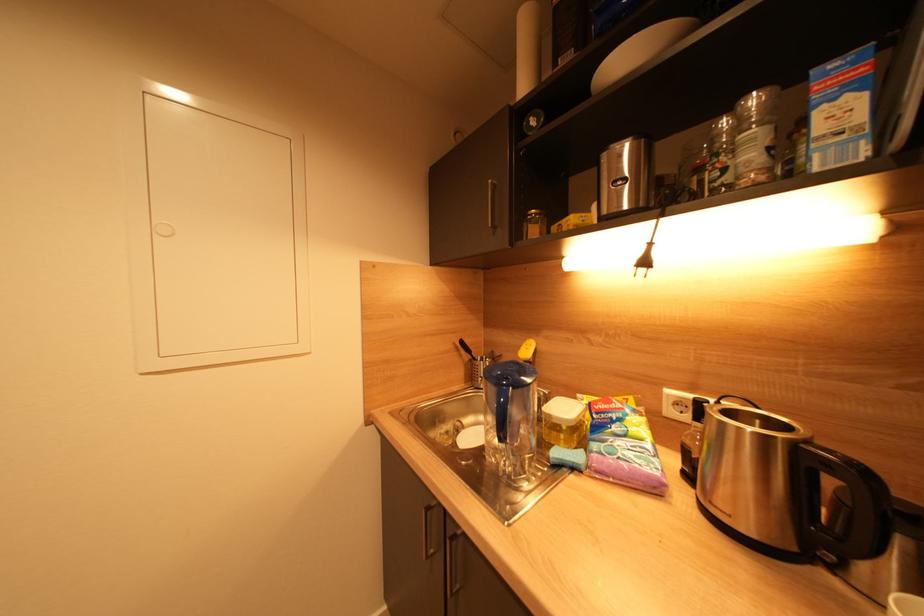
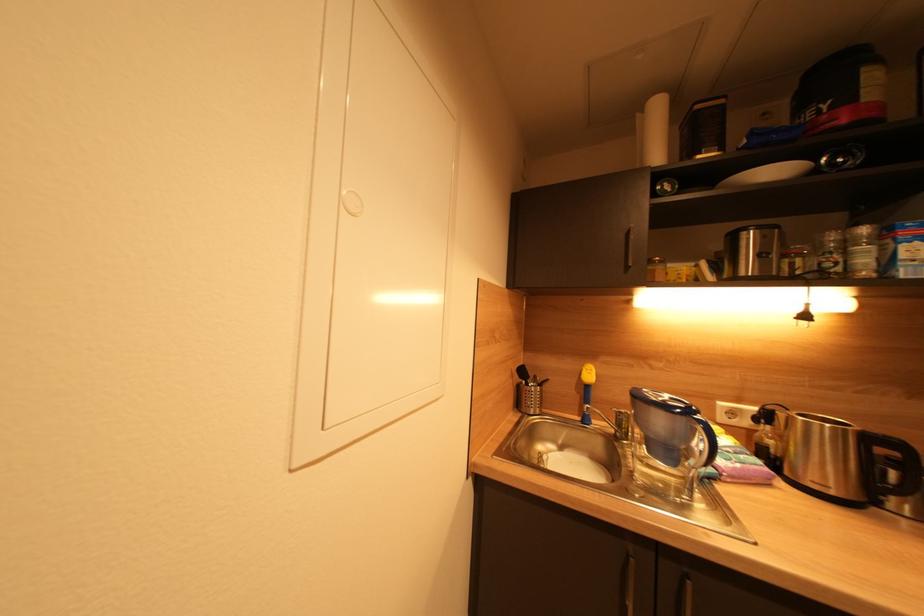
Question: What movement of the cameraman would produce the second image?

Choices:
 (A) Left
 (B) Right
 (C) Forward
 (D) Backward

Answer: (A)